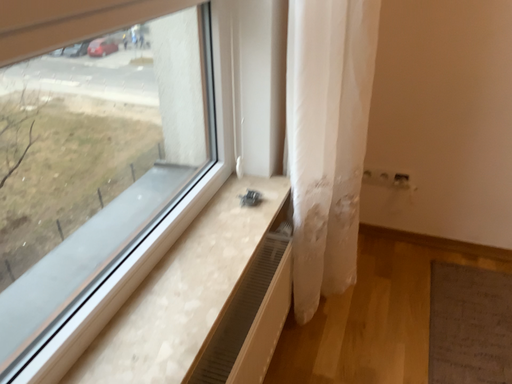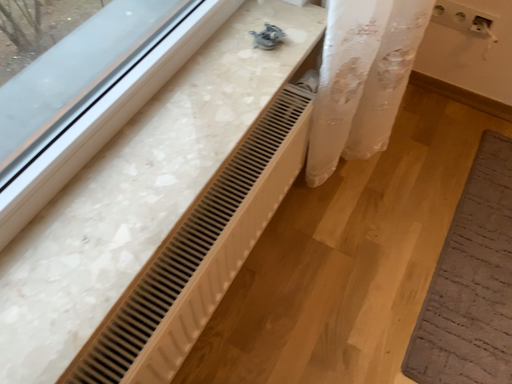
Question: How did the camera likely rotate when shooting the video?

Choices:
 (A) rotated left
 (B) rotated right

Answer: (A)